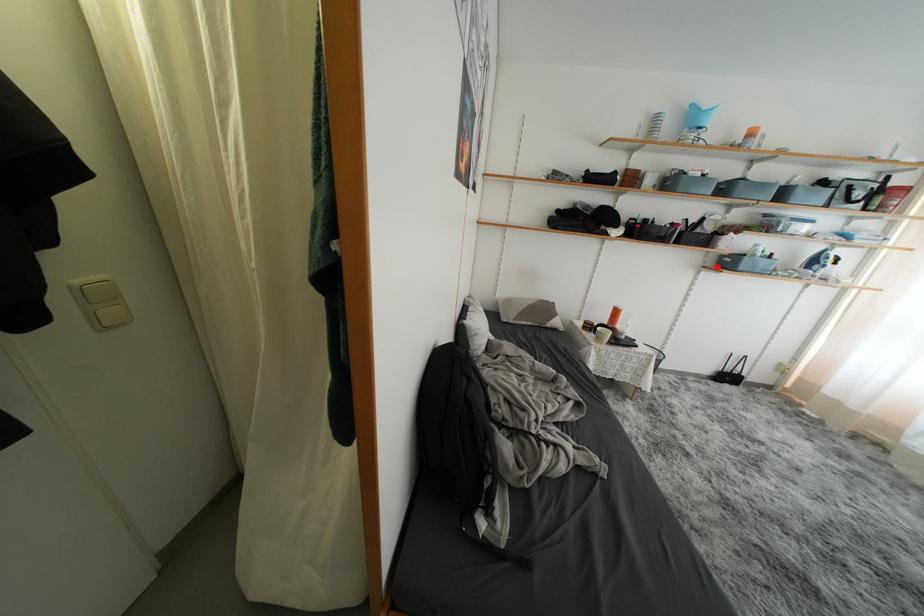
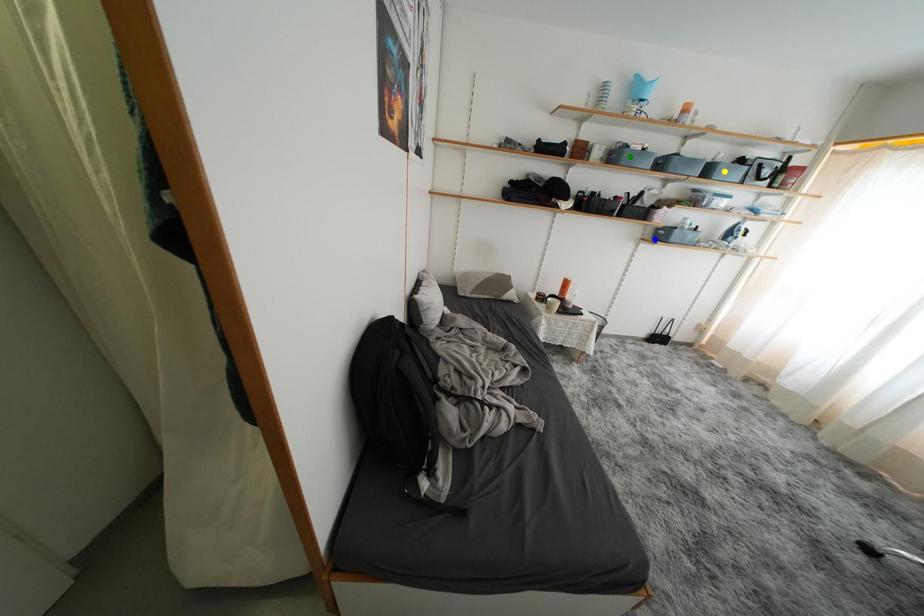
Question: I am providing you with two images of the same scene from different viewpoints. A red point is marked on the first image. You are given multiple points on the second image. Can you choose the point in image 2 that corresponds to the point in image 1?

Choices:
 (A) blue point
 (B) green point
 (C) yellow point

Answer: (A)